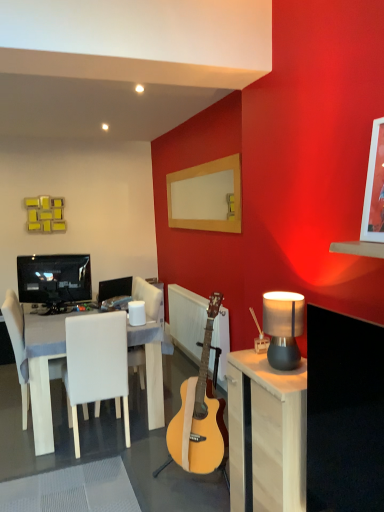
Question: Are white wood table at left and wooden picture frame at upper right located far from each other?

Choices:
 (A) no
 (B) yes

Answer: (B)

Question: Can you confirm if white wood table at left is positioned to the left of wooden picture frame at upper right?

Choices:
 (A) no
 (B) yes

Answer: (B)

Question: Is white wood table at left further to camera compared to wooden picture frame at upper right?

Choices:
 (A) no
 (B) yes

Answer: (B)

Question: Does white wood table at left have a larger size compared to wooden picture frame at upper right?

Choices:
 (A) no
 (B) yes

Answer: (B)

Question: From a real-world perspective, is white wood table at left located beneath wooden picture frame at upper right?

Choices:
 (A) no
 (B) yes

Answer: (B)

Question: Is point (107, 288) closer or farther from the camera than point (19, 354)?

Choices:
 (A) closer
 (B) farther

Answer: (B)

Question: In the image, is matte black monitor at center, the second television positioned from the left, on the left side or the right side of white fabric chair at left, the 2th chair from the right?

Choices:
 (A) left
 (B) right

Answer: (B)

Question: Is matte black monitor at center, which appears as the first television when viewed from the right, in front of or behind white fabric chair at left, acting as the first chair starting from the left, in the image?

Choices:
 (A) front
 (B) behind

Answer: (B)

Question: From the image's perspective, is matte black monitor at center, which is the 2th television in front-to-back order, located above or below white fabric chair at left, acting as the first chair starting from the left?

Choices:
 (A) above
 (B) below

Answer: (A)

Question: Does point (377, 145) appear closer or farther from the camera than point (117, 374)?

Choices:
 (A) farther
 (B) closer

Answer: (B)

Question: In terms of size, does wooden picture frame at upper right appear bigger or smaller than white leather chair at center, positioned as the second chair in left-to-right order?

Choices:
 (A) small
 (B) big

Answer: (A)

Question: From the image's perspective, relative to white leather chair at center, positioned as the second chair in left-to-right order, is wooden picture frame at upper right above or below?

Choices:
 (A) above
 (B) below

Answer: (A)

Question: Do you think wooden picture frame at upper right is within white leather chair at center, arranged as the first chair when viewed from the right, or outside of it?

Choices:
 (A) inside
 (B) outside

Answer: (B)

Question: Is light wood cabinet at right wider or thinner than wooden frame at upper right?

Choices:
 (A) wide
 (B) thin

Answer: (A)

Question: Considering their positions, is light wood cabinet at right located in front of or behind wooden frame at upper right?

Choices:
 (A) front
 (B) behind

Answer: (A)